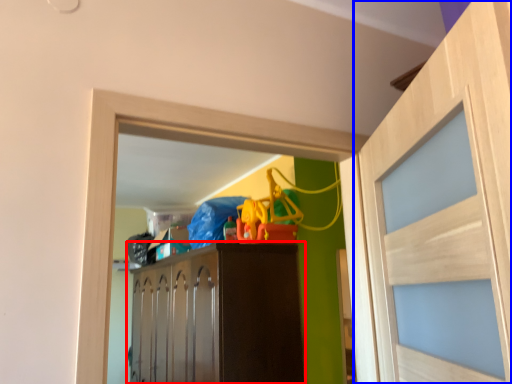
Question: Which of the following is the closest to the observer, cabinetry (highlighted by a red box) or door (highlighted by a blue box)?

Choices:
 (A) cabinetry
 (B) door

Answer: (B)